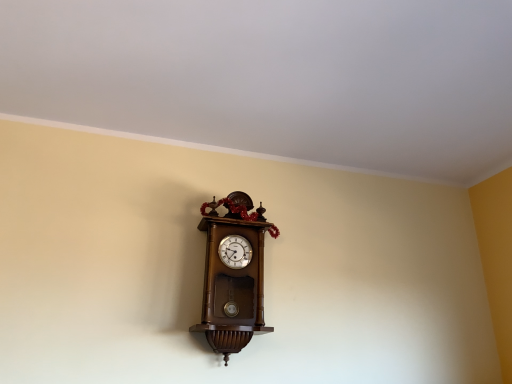
The width and height of the screenshot is (512, 384). What do you see at coordinates (233, 274) in the screenshot?
I see `mahogany wood wall clock at center` at bounding box center [233, 274].

You are a GUI agent. You are given a task and a screenshot of the screen. Output one action in this format:
    pyautogui.click(x=<x>, y=<y>)
    Task: Click on the mahogany wood wall clock at center
    This screenshot has height=384, width=512.
    Given the screenshot: What is the action you would take?
    pyautogui.click(x=233, y=274)

The image size is (512, 384). I want to click on mahogany wood wall clock at center, so click(233, 274).